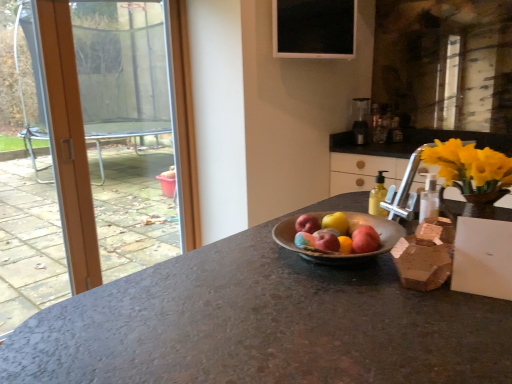
Question: Considering the relative sizes of red matte apple at center, the 1th apple from the back, and orange wood door at left in the image provided, is red matte apple at center, the 1th apple from the back, taller than orange wood door at left?

Choices:
 (A) yes
 (B) no

Answer: (B)

Question: From the image's perspective, is red matte apple at center, arranged as the 4th apple when viewed from the front, on top of orange wood door at left?

Choices:
 (A) yes
 (B) no

Answer: (B)

Question: Does red matte apple at center, the 1th apple from the back, have a lesser height compared to orange wood door at left?

Choices:
 (A) yes
 (B) no

Answer: (A)

Question: Can you see red matte apple at center, arranged as the 4th apple when viewed from the front, touching orange wood door at left?

Choices:
 (A) no
 (B) yes

Answer: (A)

Question: Could you tell me if red matte apple at center, the 1th apple from the back, is facing orange wood door at left?

Choices:
 (A) yes
 (B) no

Answer: (B)

Question: Considering the positions of matte pink apple at center, the first apple positioned from the front, and yellow wood cabinet at upper right in the image, is matte pink apple at center, the first apple positioned from the front, wider or thinner than yellow wood cabinet at upper right?

Choices:
 (A) thin
 (B) wide

Answer: (A)

Question: Which is correct: matte pink apple at center, the 4th apple viewed from the back, is inside yellow wood cabinet at upper right, or outside of it?

Choices:
 (A) outside
 (B) inside

Answer: (A)

Question: From the image's perspective, is matte pink apple at center, the 4th apple viewed from the back, positioned above or below yellow wood cabinet at upper right?

Choices:
 (A) below
 (B) above

Answer: (A)

Question: In the image, is matte pink apple at center, the 4th apple viewed from the back, positioned in front of or behind yellow wood cabinet at upper right?

Choices:
 (A) front
 (B) behind

Answer: (A)

Question: From the image's perspective, is satin silver blender at upper right located above or below matte pink apple at center, the 4th apple viewed from the back?

Choices:
 (A) below
 (B) above

Answer: (B)

Question: From their relative heights in the image, would you say satin silver blender at upper right is taller or shorter than matte pink apple at center, the 4th apple viewed from the back?

Choices:
 (A) short
 (B) tall

Answer: (B)

Question: Considering their positions, is satin silver blender at upper right located in front of or behind matte pink apple at center, the first apple positioned from the front?

Choices:
 (A) front
 (B) behind

Answer: (B)

Question: Do you think satin silver blender at upper right is within matte pink apple at center, the 4th apple viewed from the back, or outside of it?

Choices:
 (A) inside
 (B) outside

Answer: (B)

Question: Is red matte apple at center, the 1th apple from the back, wider or thinner than yellow translucent bottle at right?

Choices:
 (A) wide
 (B) thin

Answer: (B)

Question: Considering the positions of red matte apple at center, the 1th apple from the back, and yellow translucent bottle at right in the image, is red matte apple at center, the 1th apple from the back, taller or shorter than yellow translucent bottle at right?

Choices:
 (A) short
 (B) tall

Answer: (A)